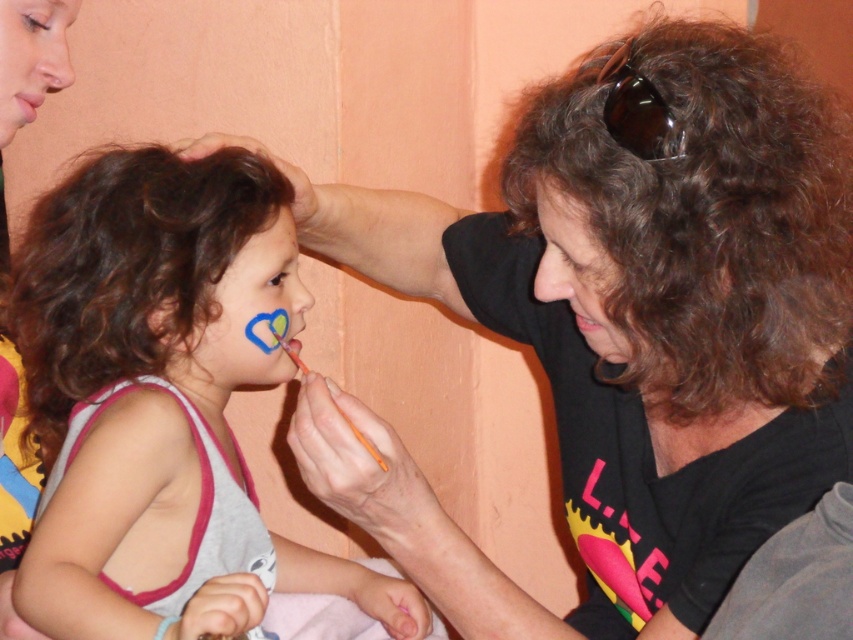
Question: Which is nearer to the matte blue face paint at left?

Choices:
 (A) matte pink lips at center
 (B) matte black face paint at upper right
 (C) dark curly hair at left
 (D) smooth skin at upper left

Answer: (C)

Question: Is smooth skin at upper left thinner than pink matte lips at center?

Choices:
 (A) no
 (B) yes

Answer: (A)

Question: Is brown curly hair at upper right below dark curly hair at left?

Choices:
 (A) no
 (B) yes

Answer: (A)

Question: From the image, what is the correct spatial relationship of matte black face paint at upper right in relation to pink matte lips at center?

Choices:
 (A) right
 (B) left

Answer: (A)

Question: Which object is positioned farthest from the pink matte lips at center?

Choices:
 (A) matte blue face paint at left
 (B) smooth skin at upper left

Answer: (A)

Question: Which point appears closest to the camera in this image?

Choices:
 (A) (300, 288)
 (B) (186, 436)
 (C) (45, 51)

Answer: (C)